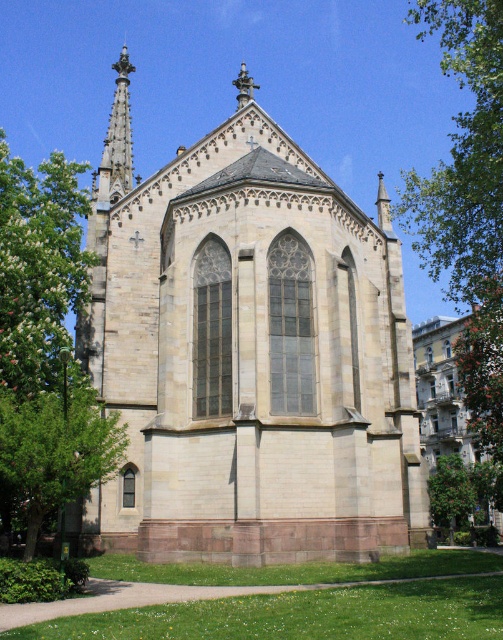
Question: Is polished stone spire at upper left positioned in front of green leafy tree at lower right?

Choices:
 (A) no
 (B) yes

Answer: (B)

Question: Which point is farther from the camera taking this photo?

Choices:
 (A) (452, 211)
 (B) (116, 120)

Answer: (B)

Question: Can you confirm if beige stone church at center is wider than green leafy tree at left?

Choices:
 (A) yes
 (B) no

Answer: (B)

Question: Which object is the closest to the green leafy tree at upper right?

Choices:
 (A) green leafy tree at left
 (B) green leafy tree at lower right
 (C) beige stone church at center

Answer: (C)

Question: Which point appears closest to the camera in this image?

Choices:
 (A) (263, 314)
 (B) (461, 470)
 (C) (123, 193)

Answer: (A)

Question: Where is green leafy tree at upper right located in relation to green leafy tree at lower left in the image?

Choices:
 (A) right
 (B) left

Answer: (A)